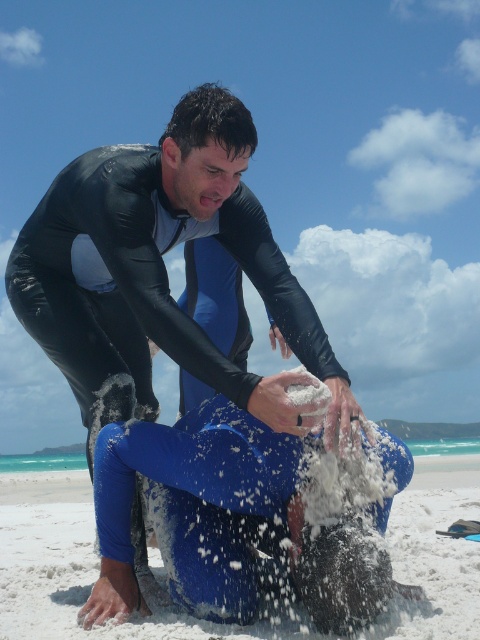
You are a photographer trying to capture the scene at the beach. You notice the black wetsuit at center and the blue fabric at lower center. Which object should you focus on first if you want to highlight the smaller one in your photo?

The black wetsuit at center is smaller than the blue fabric at lower center, so you should focus on the black wetsuit at center first to highlight its smaller size.

You are a photographer at the beach. You need to decide which object, the black wetsuit at center or the blue fabric at lower center, would be easier to capture in a closeup shot without moving the camera. Which one should you choose and why?

The black wetsuit at center is thinner than the blue fabric at lower center, so it would be easier to capture in a closeup shot without moving the camera because its smaller size allows it to fit within the current frame.

You are a photographer standing at the edge of the beach, and you want to capture a photo where both the black wetsuit at center and the blue fabric at lower center are clearly visible. Based on their positions, which object is closer to the camera?

The black wetsuit at center is in front of the blue fabric at lower center, so it is closer to the camera.